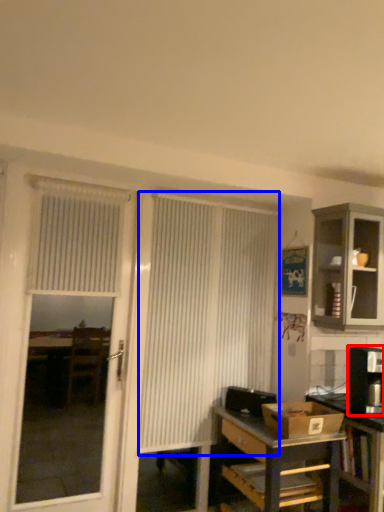
Question: Which of the following is the closest to the observer, appliance (highlighted by a red box) or curtain (highlighted by a blue box)?

Choices:
 (A) appliance
 (B) curtain

Answer: (A)